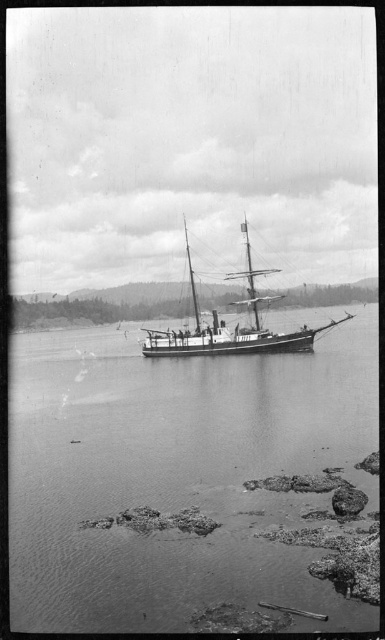
You are a photographer trying to capture the wooden ship at center in your shot. Since you want to include the smooth water at center in the background, will the water be visible behind the ship?

The smooth water at center is not as tall as the wooden ship at center, so the water will be visible behind the ship because it is lower in height compared to the ship.

You are a photographer standing on the rocky beach in the foreground of the image. You want to capture a clear reflection of the ship in the water. Based on the scene description, where should you position yourself to ensure the smooth water at center is visible in your shot?

You should position yourself near the smooth water at center located at coordinates point (177, 474) to capture its reflection of the ship.